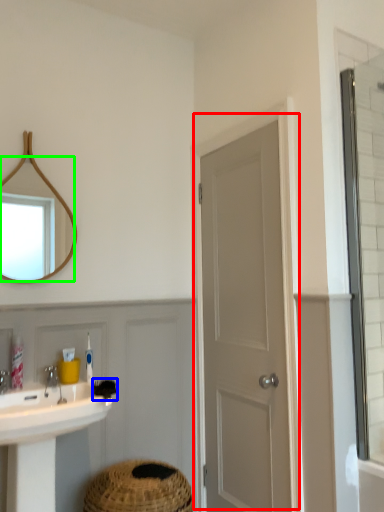
Question: Which is nearer to the door (highlighted by a red box)? brush (highlighted by a blue box) or mirror (highlighted by a green box).

Choices:
 (A) brush
 (B) mirror

Answer: (A)